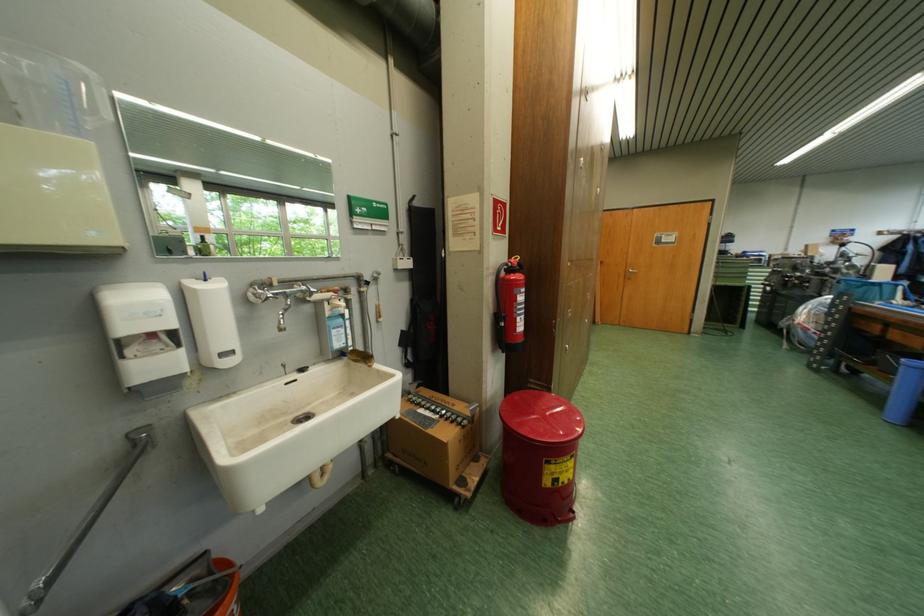
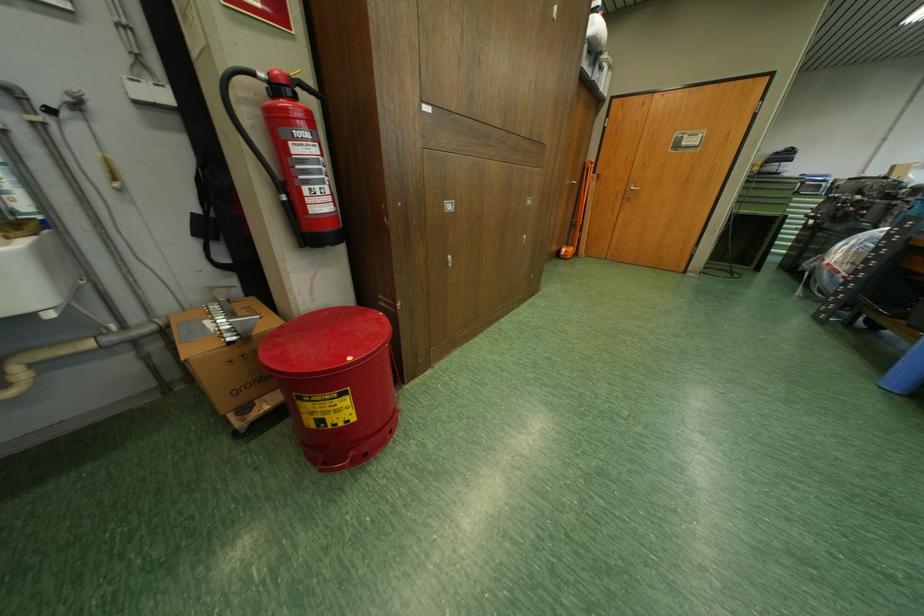
What movement of the cameraman would produce the second image?

The cameraman walked toward right, forward.